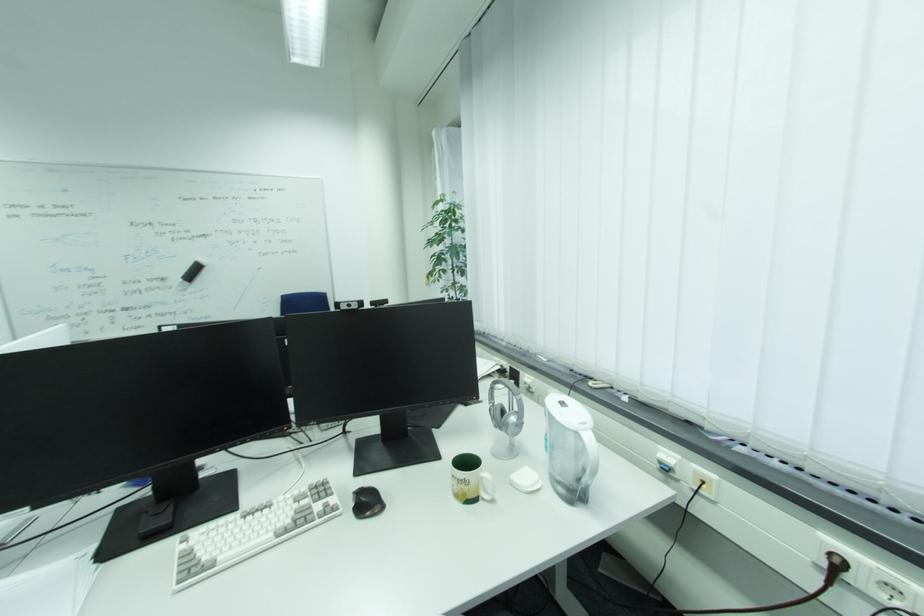
At what (x,y) coordinates should I click in order to perform the action: click on white mug handle. Please return your answer as a coordinate pair (x, y). Looking at the image, I should click on (487, 493).